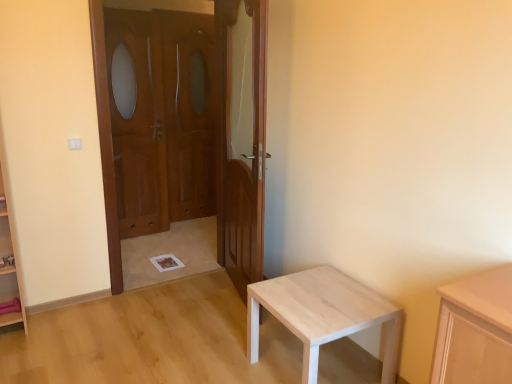
Find the location of a particular element. The image size is (512, 384). free space to the right of wooden screen door at center, the 1th screen door in the left-to-right sequence is located at coordinates (170, 241).